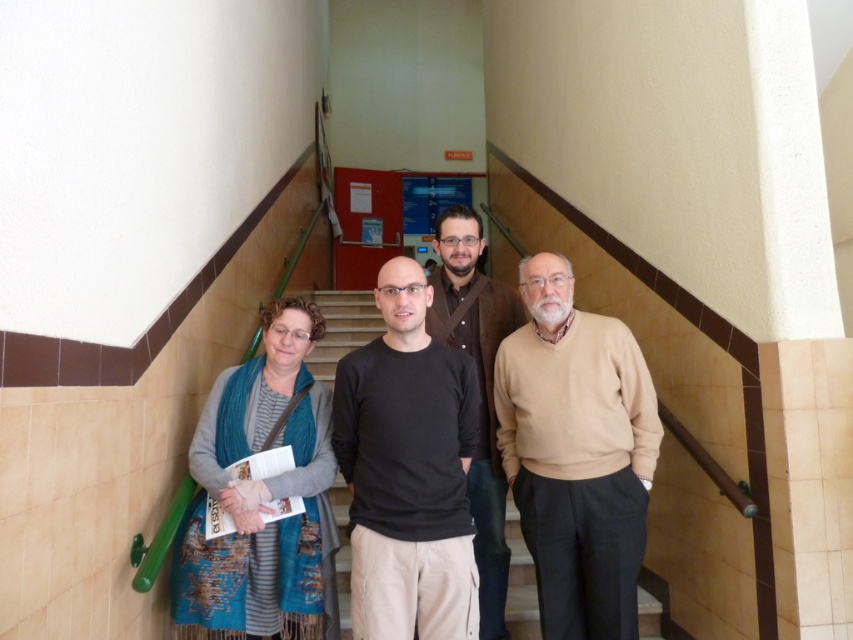
Who is shorter, beige sweater at center or blue textured scarf at left?

blue textured scarf at left is shorter.

Does beige sweater at center appear on the right side of blue textured scarf at left?

Indeed, beige sweater at center is positioned on the right side of blue textured scarf at left.

Is point (558, 332) closer to viewer compared to point (190, 596)?

No, (558, 332) is behind (190, 596).

This screenshot has height=640, width=853. What are the coordinates of `beige sweater at center` in the screenshot? It's located at (576, 452).

How far apart are beige sweater at center and brown textured jacket at center?

12.08 inches

Which is behind, point (502, 412) or point (431, 326)?

The point (431, 326) is behind.

What do you see at coordinates (576, 452) in the screenshot? This screenshot has width=853, height=640. I see `beige sweater at center` at bounding box center [576, 452].

Find the location of a particular element. This screenshot has height=640, width=853. beige sweater at center is located at coordinates (576, 452).

Between black matte shirt at center and brown textured jacket at center, which one is positioned lower?

brown textured jacket at center is below.

Is black matte shirt at center wider than brown textured jacket at center?

Indeed, black matte shirt at center has a greater width compared to brown textured jacket at center.

Who is more forward, (363, 588) or (480, 490)?

Point (363, 588)

Where is `black matte shirt at center`? This screenshot has height=640, width=853. black matte shirt at center is located at coordinates (408, 470).